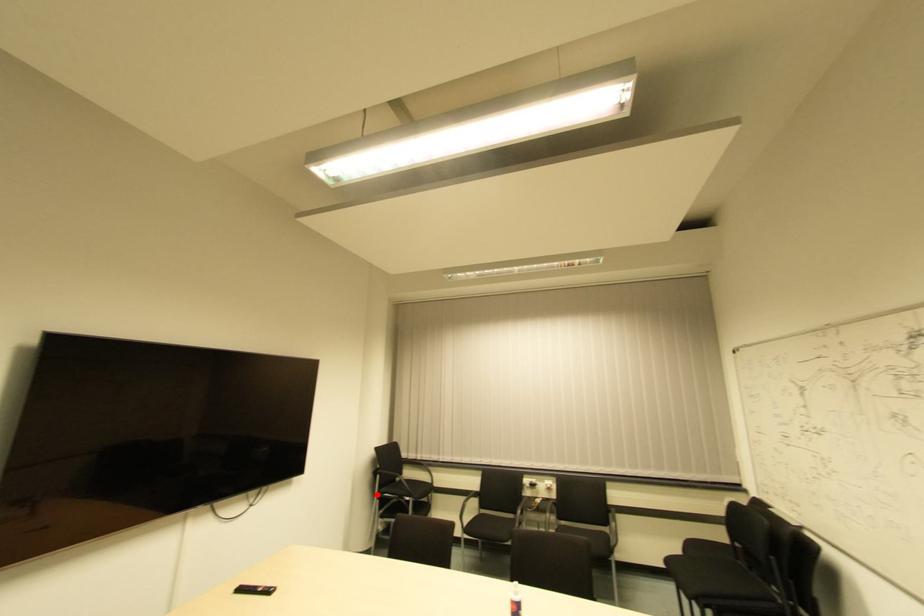
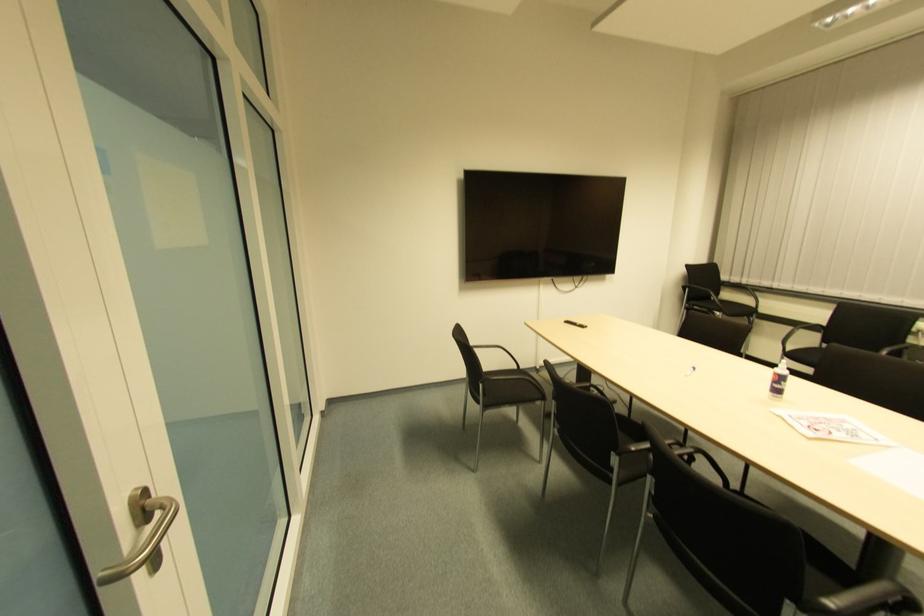
In the second image, find the point that corresponds to the highlighted location in the first image.

(685, 306)